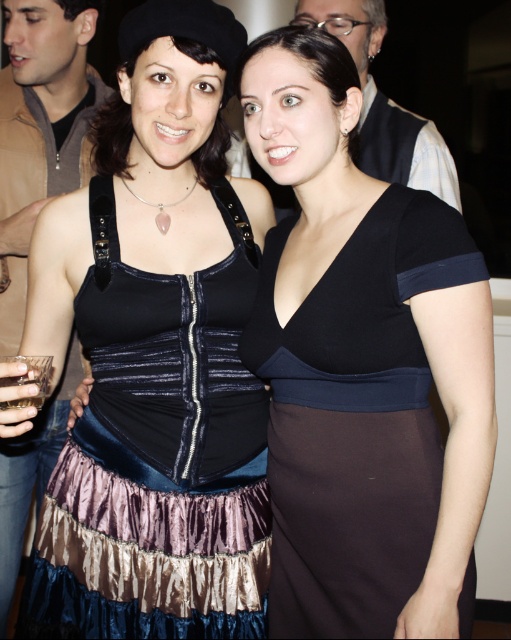
Consider the image. You are at a social event and want to take a photo of both women. You notice two points in the image labeled as point (x=152, y=344) and point (x=283, y=595). Which point is closer to you?

Point (x=152, y=344) is closer to the viewer than point (x=283, y=595).